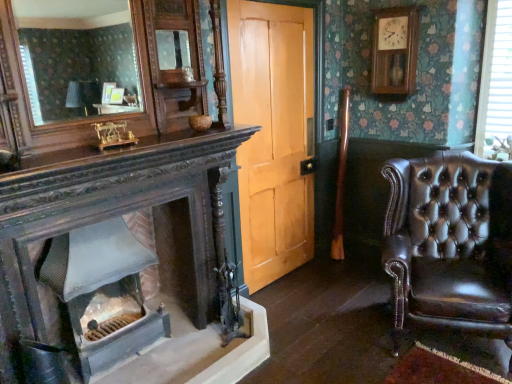
Find the location of a particular element. vacant area located to the right-hand side of light brown wood door at center is located at coordinates (340, 285).